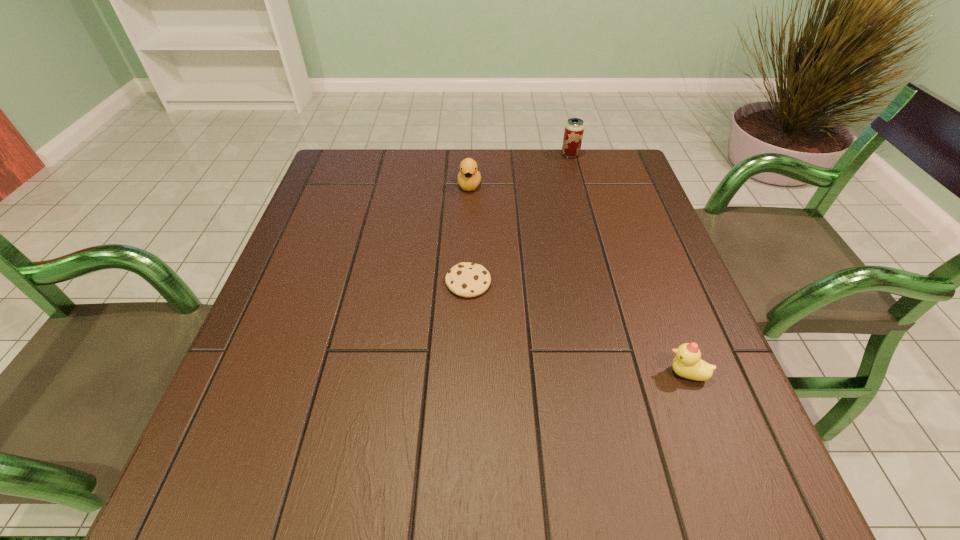
Locate an element on the screen. free space located on the front-facing side of the nearer duckling is located at coordinates (488, 373).

Locate an element on the screen. The width and height of the screenshot is (960, 540). free location located on the front-facing side of the nearer duckling is located at coordinates pyautogui.click(x=546, y=373).

Locate an element on the screen. vacant space located on the front-facing side of the nearer duckling is located at coordinates (616, 373).

Where is `free location located 0.100m on the front of the shortest object`? This screenshot has height=540, width=960. free location located 0.100m on the front of the shortest object is located at coordinates (467, 338).

This screenshot has width=960, height=540. I want to click on beer can located at the far edge, so click(574, 128).

The width and height of the screenshot is (960, 540). I want to click on duckling located in the far edge section of the desktop, so click(468, 178).

This screenshot has height=540, width=960. I want to click on beer can that is at the right edge, so click(574, 128).

This screenshot has height=540, width=960. I want to click on duckling that is at the right edge, so click(688, 363).

Where is `object that is at the far right corner`? object that is at the far right corner is located at coordinates (574, 128).

I want to click on vacant region at the far edge of the desktop, so click(x=518, y=188).